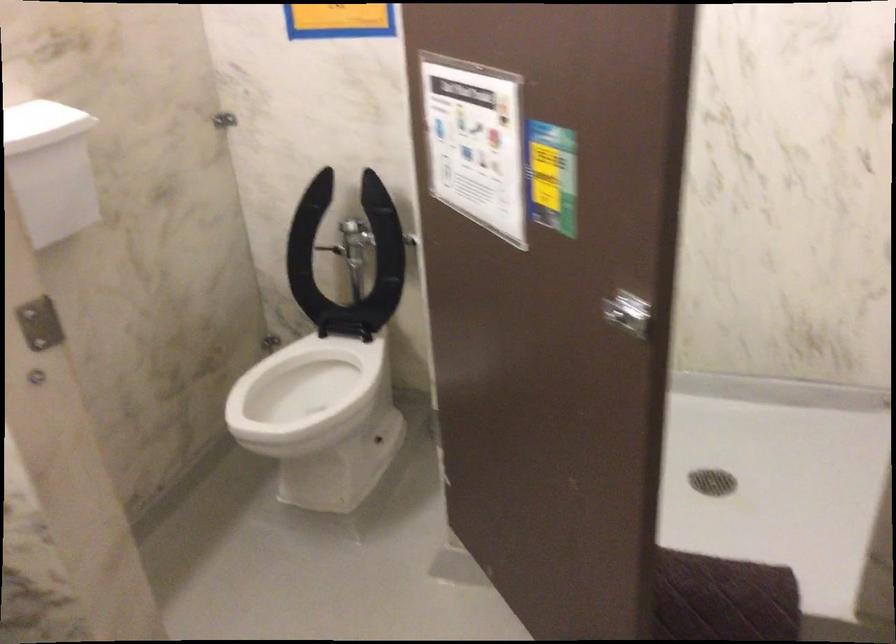
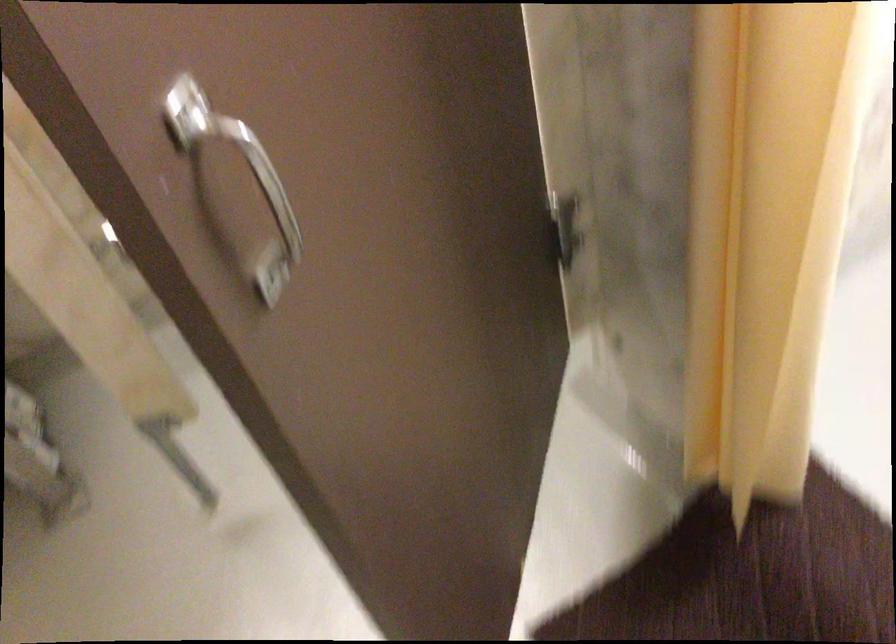
First-person continuous shooting, in which direction is the camera rotating?

The rotation direction of the camera is left-down.